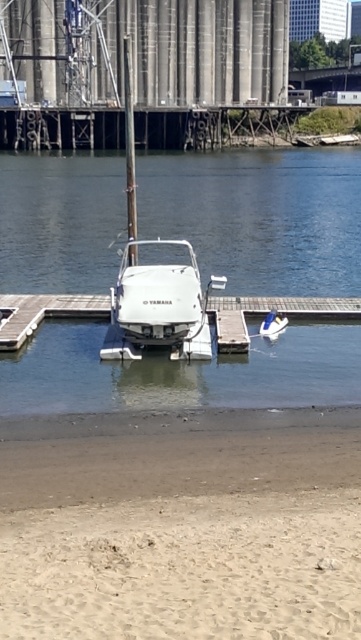
Question: Among these points, which one is farthest from the camera?

Choices:
 (A) (114, 291)
 (B) (0, 346)
 (C) (93, 541)
 (D) (15, 403)

Answer: (A)

Question: Is white matte boat at center bigger than white plastic dock at center?

Choices:
 (A) no
 (B) yes

Answer: (A)

Question: Which object is positioned farthest from the white matte boat at center?

Choices:
 (A) white plastic dock at center
 (B) sandy beach at lower center
 (C) white glossy boat at center

Answer: (C)

Question: Which of the following is the farthest from the observer?

Choices:
 (A) sandy beach at lower center
 (B) white matte boat at center
 (C) white glossy boat at center
 (D) white plastic dock at center

Answer: (D)

Question: Is sandy beach at lower center below white plastic dock at center?

Choices:
 (A) yes
 (B) no

Answer: (A)

Question: Can you confirm if sandy beach at lower center is smaller than white glossy boat at center?

Choices:
 (A) no
 (B) yes

Answer: (B)